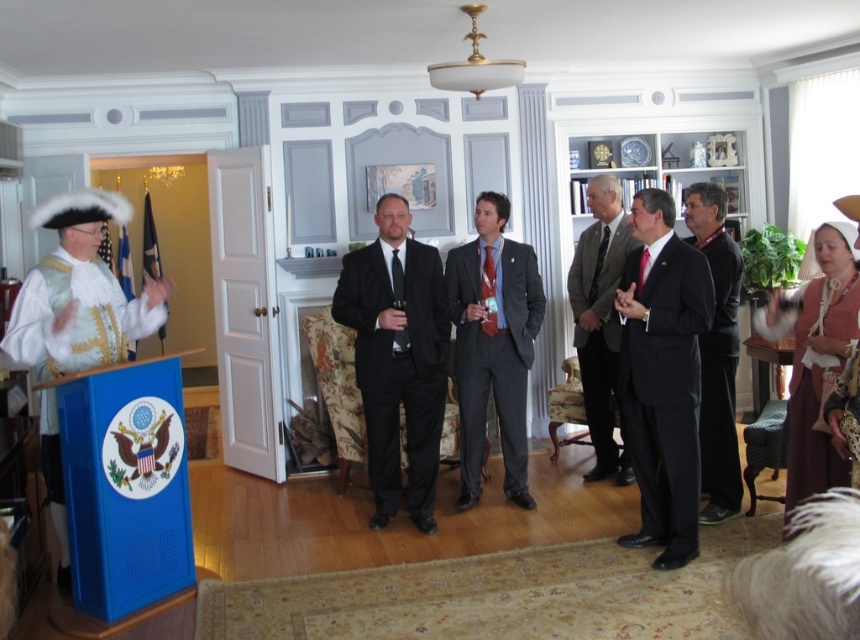
Between black suit at right and brown satin dress at lower right, which one is positioned higher?

black suit at right is above.

Can you confirm if black suit at right is positioned to the left of brown satin dress at lower right?

Indeed, black suit at right is positioned on the left side of brown satin dress at lower right.

Measure the distance between point (710, 348) and camera.

Point (710, 348) and camera are 4.17 meters apart.

Find the location of a particular element. black suit at right is located at coordinates (717, 353).

Is black satin suit at center shorter than white satin hat at left?

Correct, black satin suit at center is not as tall as white satin hat at left.

Who is positioned more to the right, black satin suit at center or white satin hat at left?

Positioned to the right is black satin suit at center.

The height and width of the screenshot is (640, 860). Find the location of `black satin suit at center`. black satin suit at center is located at coordinates (662, 376).

Locate an element on the screen. black satin suit at center is located at coordinates (662, 376).

Describe the element at coordinates (493, 344) in the screenshot. The height and width of the screenshot is (640, 860). I see `gray wool suit at center` at that location.

Which is more to the right, gray wool suit at center or black suit at right?

Positioned to the right is black suit at right.

Who is more forward, [486,211] or [717,257]?

Point [717,257] is more forward.

Find the location of a particular element. The height and width of the screenshot is (640, 860). gray wool suit at center is located at coordinates (493, 344).